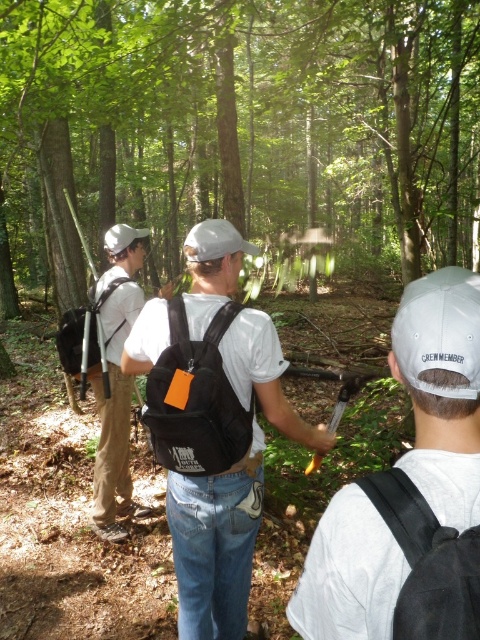
You are a photographer standing in the forest and want to take a photo of the green leafy tree at center and the black fabric backpack at center. Which object should you focus on first if you want to capture both in focus?

The black fabric backpack at center is closer to you than the green leafy tree at center, so you should focus on the black fabric backpack at center first to ensure both are in focus.

You are a member of the YOUTH CORPS team in the forest. You need to retrieve your black fabric backpack at center but it is currently obstructed by the green leafy tree at center. To access it, you must move around the tree. Which direction should you go relative to the tree to reach the backpack?

The black fabric backpack at center is behind the green leafy tree at center, so you should go behind the green leafy tree at center to retrieve it.